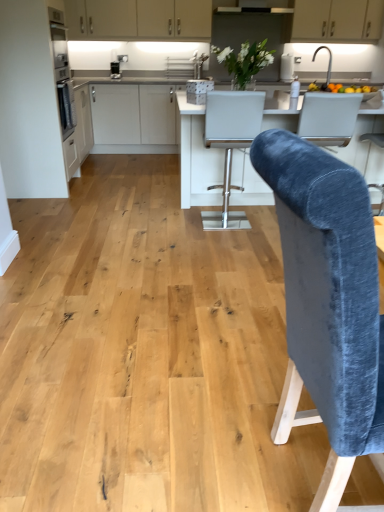
Question: Is satin black coffee machine at upper left far away from matte white cabinets at upper center, arranged as the 2th cabinetry when viewed from the left?

Choices:
 (A) no
 (B) yes

Answer: (A)

Question: Is satin black coffee machine at upper left wider than matte white cabinets at upper center, arranged as the 2th cabinetry when viewed from the left?

Choices:
 (A) yes
 (B) no

Answer: (B)

Question: Considering the relative sizes of satin black coffee machine at upper left and matte white cabinets at upper center, the 2th cabinetry positioned from the back, in the image provided, is satin black coffee machine at upper left shorter than matte white cabinets at upper center, the 2th cabinetry positioned from the back,?

Choices:
 (A) yes
 (B) no

Answer: (A)

Question: From the image's perspective, is satin black coffee machine at upper left under matte white cabinets at upper center, the 2th cabinetry positioned from the back?

Choices:
 (A) yes
 (B) no

Answer: (A)

Question: Does satin black coffee machine at upper left come behind matte white cabinets at upper center, arranged as the 2th cabinetry when viewed from the left?

Choices:
 (A) no
 (B) yes

Answer: (B)

Question: Looking at their shapes, would you say white matte cabinet at upper center, arranged as the third cabinetry when viewed from the front, is wider or thinner than matte white cabinets at upper center, the 2th cabinetry positioned from the back?

Choices:
 (A) thin
 (B) wide

Answer: (A)

Question: From a real-world perspective, is white matte cabinet at upper center, arranged as the third cabinetry when viewed from the front, above or below matte white cabinets at upper center, the 2th cabinetry viewed from the top?

Choices:
 (A) above
 (B) below

Answer: (A)

Question: From their relative heights in the image, would you say white matte cabinet at upper center, the third cabinetry from the left, is taller or shorter than matte white cabinets at upper center, the 2th cabinetry viewed from the top?

Choices:
 (A) short
 (B) tall

Answer: (B)

Question: From the image's perspective, is white matte cabinet at upper center, placed as the third cabinetry when sorted from bottom to top, above or below matte white cabinets at upper center, the 2th cabinetry viewed from the top?

Choices:
 (A) below
 (B) above

Answer: (B)

Question: Is velvet blue chair at center, which appears as the 2th chair when viewed from the back, spatially inside satin black coffee machine at upper left, or outside of it?

Choices:
 (A) inside
 (B) outside

Answer: (B)

Question: Relative to satin black coffee machine at upper left, is velvet blue chair at center, positioned as the second chair in top-to-bottom order, in front or behind?

Choices:
 (A) behind
 (B) front

Answer: (B)

Question: Does point (344, 332) appear closer or farther from the camera than point (112, 70)?

Choices:
 (A) closer
 (B) farther

Answer: (A)

Question: From the image's perspective, relative to satin black coffee machine at upper left, is velvet blue chair at center, which appears as the 2th chair when viewed from the back, above or below?

Choices:
 (A) above
 (B) below

Answer: (B)

Question: Does point (342, 420) appear closer or farther from the camera than point (248, 94)?

Choices:
 (A) farther
 (B) closer

Answer: (B)

Question: From a real-world perspective, is velvet blue chair at center, positioned as the second chair in top-to-bottom order, positioned above or below white leather bar stool at center, the first chair positioned from the back?

Choices:
 (A) below
 (B) above

Answer: (B)